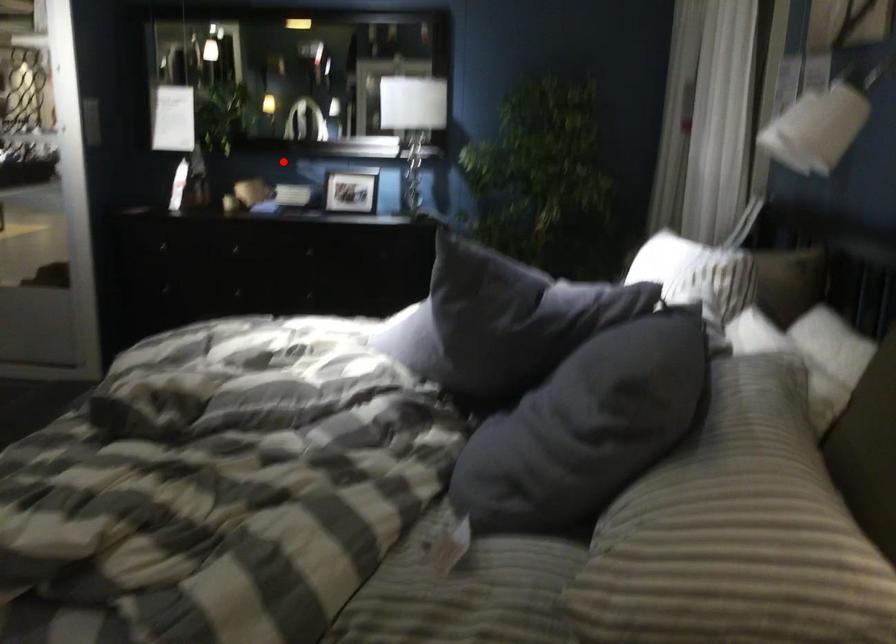
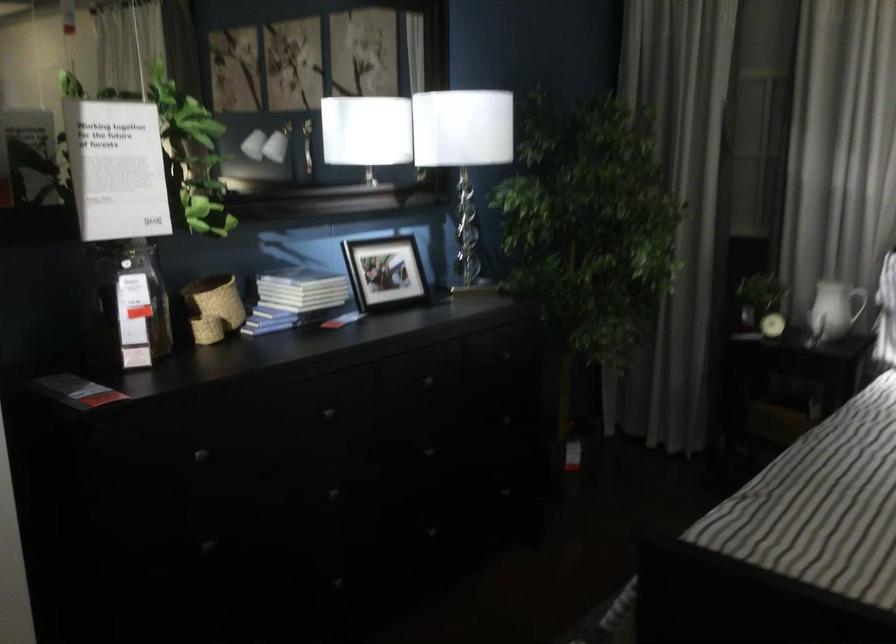
Question: I am providing you with two images of the same scene from different viewpoints. In image1, a red point is highlighted. Considering the same 3D point in image2, which of the following is correct?

Choices:
 (A) It is closer
 (B) It is farther

Answer: (A)